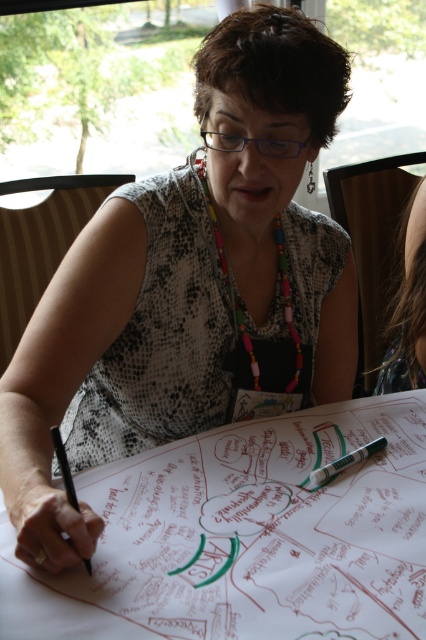
Question: Can you confirm if white paper at center is wider than black matte pen at lower left?

Choices:
 (A) yes
 (B) no

Answer: (A)

Question: Can you confirm if green matte marker at center is positioned above black matte pen at lower left?

Choices:
 (A) no
 (B) yes

Answer: (B)

Question: Which of the following is the closest to the observer?

Choices:
 (A) (391, 365)
 (B) (371, 445)
 (C) (189, 544)

Answer: (C)

Question: Does white paper at center have a lesser width compared to green matte marker at center?

Choices:
 (A) yes
 (B) no

Answer: (B)

Question: Which object is positioned farthest from the white paper at center?

Choices:
 (A) dark brown hair at upper right
 (B) black matte pen at lower left
 (C) green matte marker at center

Answer: (A)

Question: Which object is positioned closest to the green matte marker at center?

Choices:
 (A) black matte pen at lower left
 (B) dark brown hair at upper right

Answer: (A)